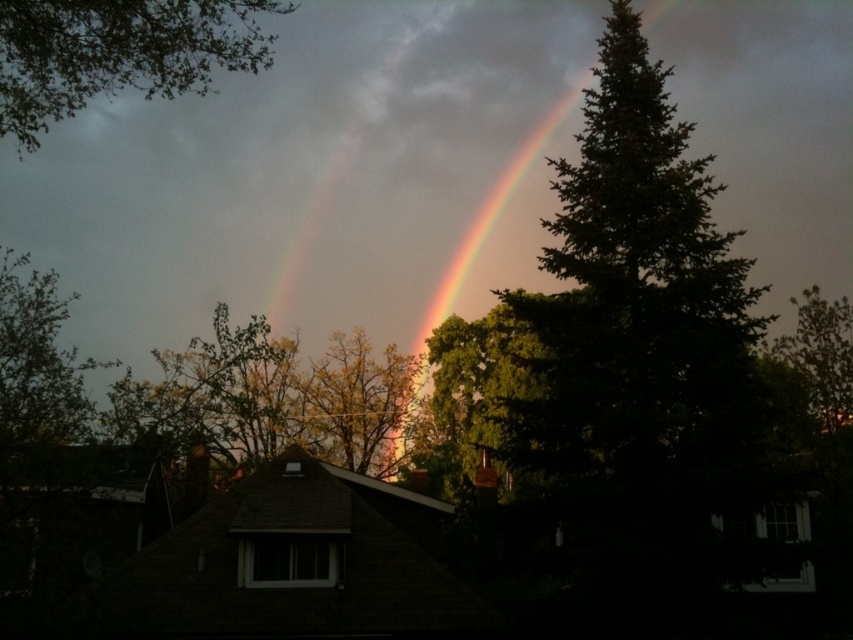
Is green leafy tree at upper left taller than green leafy tree at center?

Yes, green leafy tree at upper left is taller than green leafy tree at center.

Who is positioned more to the left, green leafy tree at upper left or green leafy tree at center?

Positioned to the left is green leafy tree at upper left.

Is point (111, 19) behind point (421, 358)?

No, it is not.

Find the location of `green leafy tree at upper left`. green leafy tree at upper left is located at coordinates (119, 52).

Between point (328, 442) and point (421, 332), which one is positioned in front?

Point (328, 442)

Does green leafy tree at center lie behind rainbow at center?

No, green leafy tree at center is in front of rainbow at center.

Which is in front, point (401, 456) or point (508, 195)?

Point (401, 456) is in front.

Where is `green leafy tree at center`? green leafy tree at center is located at coordinates (358, 403).

Can you confirm if rainbow at center is thinner than green leafy tree at right?

No.

Can you confirm if rainbow at center is taller than green leafy tree at right?

Correct, rainbow at center is much taller as green leafy tree at right.

This screenshot has width=853, height=640. Identify the location of rainbow at center. (492, 212).

This screenshot has height=640, width=853. In order to click on rainbow at center in this screenshot , I will do `click(492, 212)`.